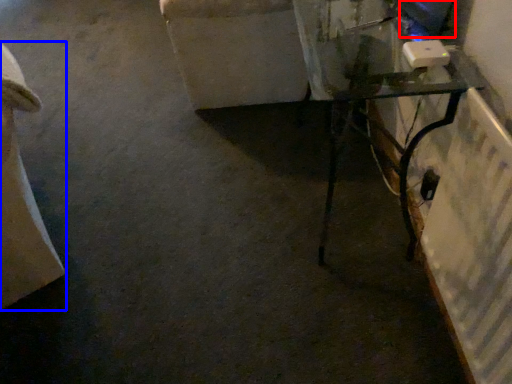
Question: Which of the following is the farthest to the observer, computer screen (highlighted by a red box) or furniture (highlighted by a blue box)?

Choices:
 (A) computer screen
 (B) furniture

Answer: (A)